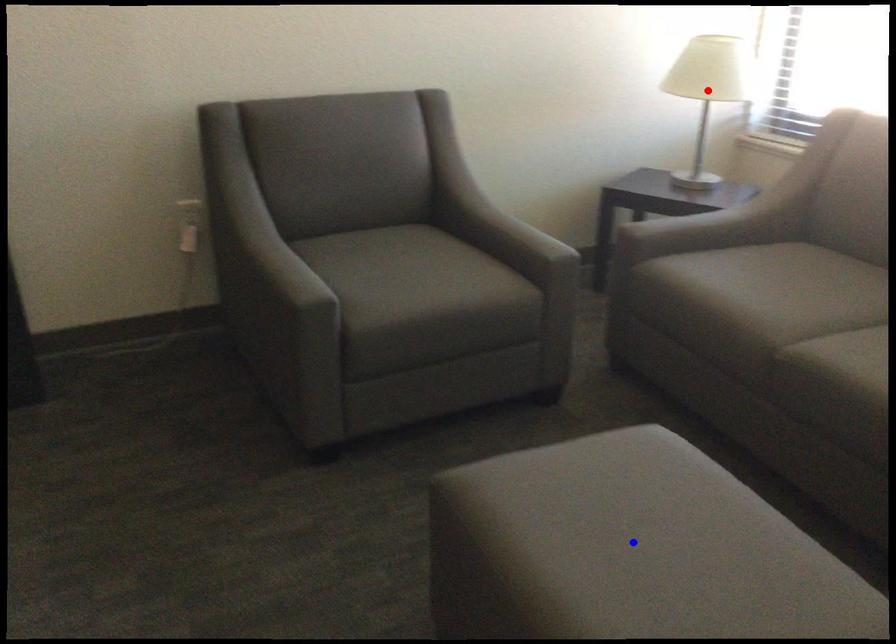
Question: In the image, two points are highlighted. Which point is nearer to the camera? Reply with the corresponding letter.

Choices:
 (A) blue point
 (B) red point

Answer: (A)